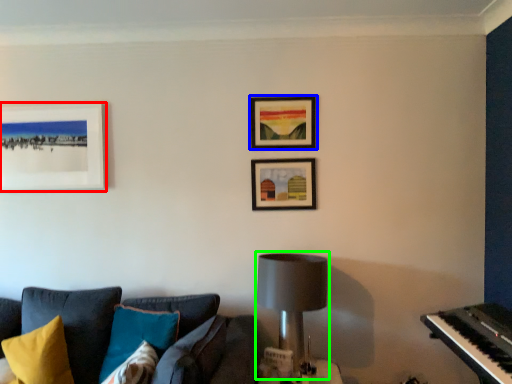
Question: Which object is positioned closest to picture frame (highlighted by a red box)? Select from picture frame (highlighted by a blue box) and table lamp (highlighted by a green box).

Choices:
 (A) picture frame
 (B) table lamp

Answer: (A)